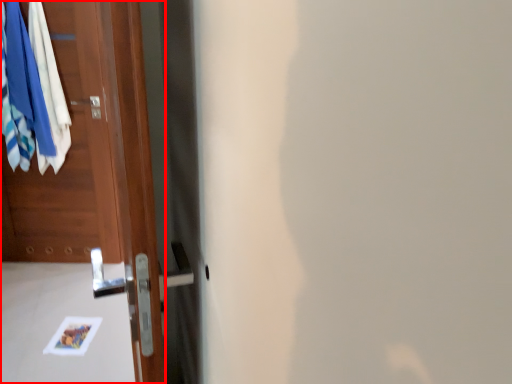
Question: Observing the image, what is the correct spatial positioning of door (annotated by the red box) in reference to clothing?

Choices:
 (A) left
 (B) right

Answer: (B)